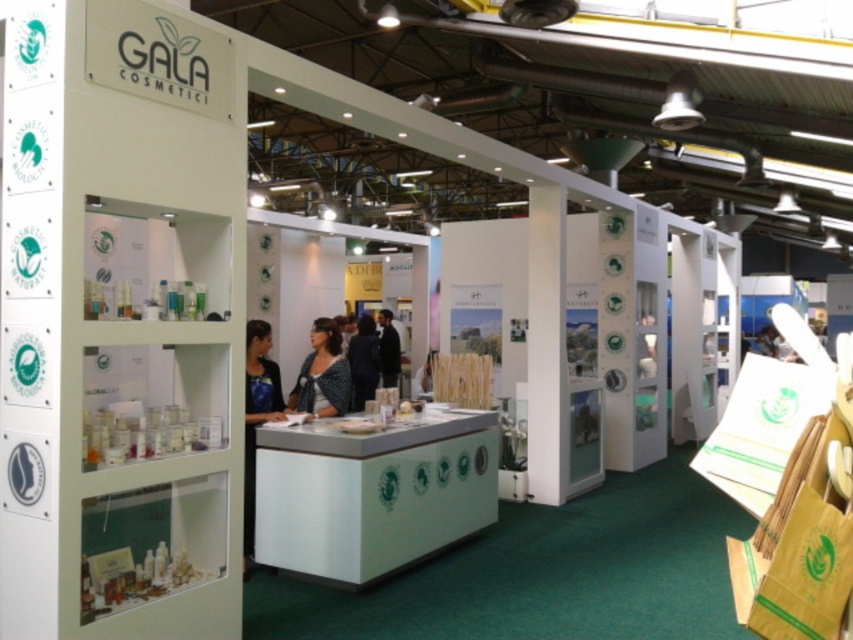
You are a visitor at the exhibition. You see the point at coordinates (257, 413). What is this point located on?

The point at coordinates (257, 413) is located on the matte black shirt at center.

In the scene shown: You are at the entrance of the booth and want to pick up the matte blue blouse at center. Which direction should you move to reach it?

The matte blue blouse at center is located at point [322,374], so you should move towards the center of the booth to reach it.